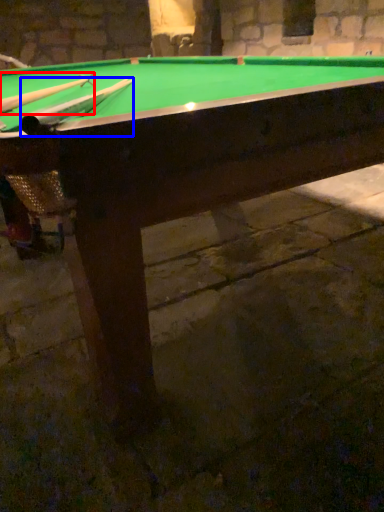
Question: Which object is further to the camera taking this photo, cue (highlighted by a red box) or cue (highlighted by a blue box)?

Choices:
 (A) cue
 (B) cue

Answer: (A)